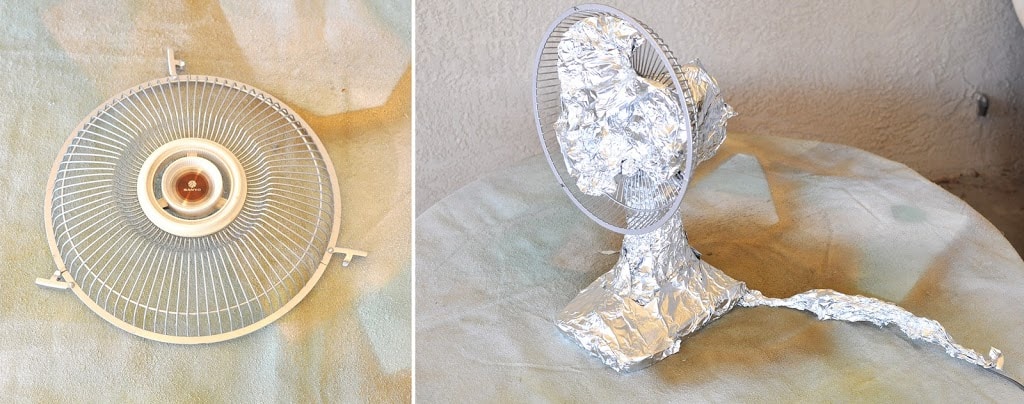
You are a GUI agent. You are given a task and a screenshot of the screen. Output one action in this format:
    pyautogui.click(x=<x>, y=<y>)
    Task: Click on the tan fabric circle table top
    
    Given the screenshot: What is the action you would take?
    pyautogui.click(x=874, y=219)